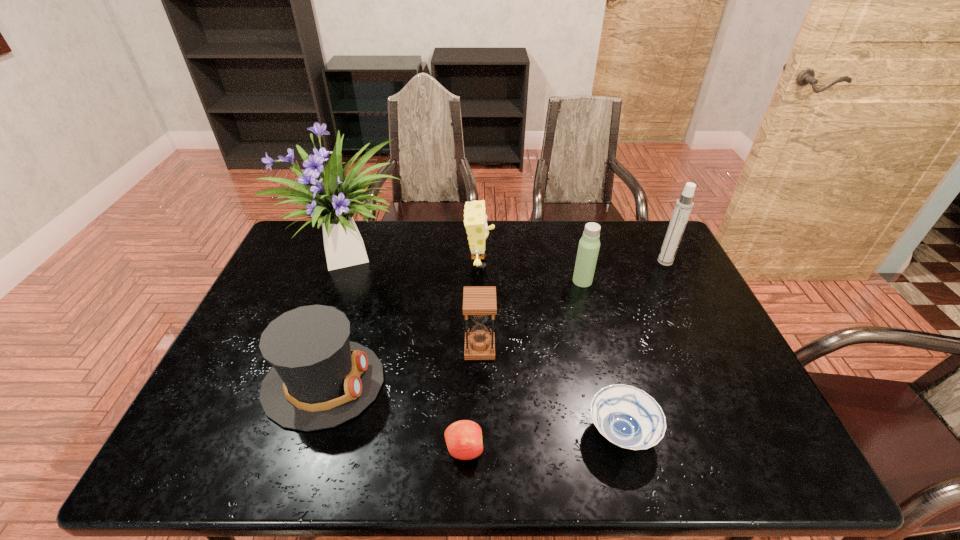
Where is `vacant region at the far left corner of the desktop`? The image size is (960, 540). vacant region at the far left corner of the desktop is located at coordinates (316, 228).

At what (x,y) coordinates should I click in order to perform the action: click on vacant space at the near left corner of the desktop. Please return your answer as a coordinate pair (x, y). The image size is (960, 540). Looking at the image, I should click on (230, 458).

Locate an element on the screen. The image size is (960, 540). free space at the far right corner of the desktop is located at coordinates (636, 248).

Image resolution: width=960 pixels, height=540 pixels. Identify the location of free spot between the apple and the hourglass. (472, 399).

In order to click on free space between the soup bowl and the dress hat in this screenshot , I will do `click(472, 408)`.

Locate an element on the screen. The height and width of the screenshot is (540, 960). vacant area that lies between the soup bowl and the apple is located at coordinates (542, 441).

Locate an element on the screen. The width and height of the screenshot is (960, 540). blank region between the dress hat and the thermos bottle is located at coordinates (453, 332).

The height and width of the screenshot is (540, 960). I want to click on vacant space that's between the hourglass and the aerosol can, so click(572, 305).

Locate an element on the screen. This screenshot has width=960, height=540. free area in between the apple and the thermos bottle is located at coordinates (523, 365).

What are the coordinates of `free point between the sponge and the dress hat` in the screenshot? It's located at (401, 323).